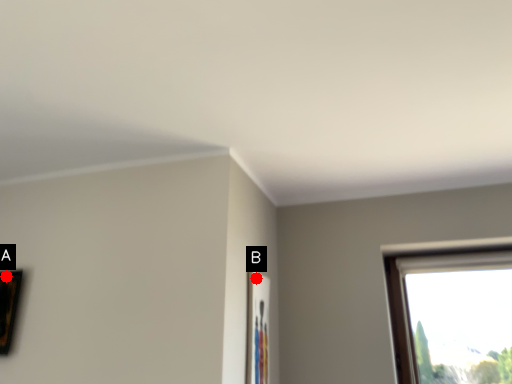
Question: Two points are circled on the image, labeled by A and B beside each circle. Which point appears farthest from the camera in this image?

Choices:
 (A) A is further
 (B) B is further

Answer: (A)